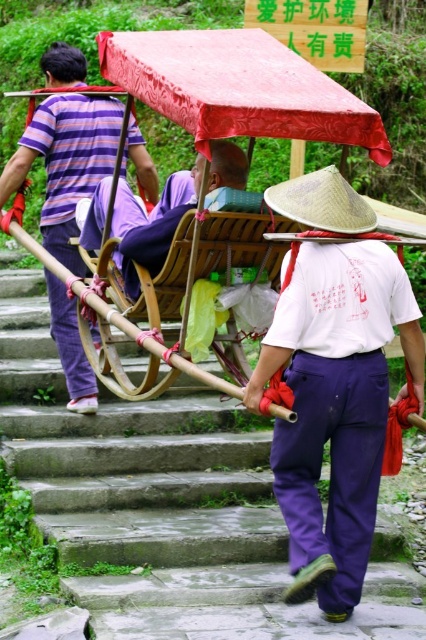
Is purple cotton pants at center shorter than natural straw hat at center?

In fact, purple cotton pants at center may be taller than natural straw hat at center.

Locate an element on the screen. purple cotton pants at center is located at coordinates (x=150, y=225).

Is wooden cart at center bigger than purple striped shirt at upper left?

Indeed, wooden cart at center has a larger size compared to purple striped shirt at upper left.

Is point (255, 84) behind point (147, 192)?

No, it is not.

At what (x,y) coordinates should I click in order to perform the action: click on wooden cart at center. Please return your answer as a coordinate pair (x, y). The height and width of the screenshot is (640, 426). Looking at the image, I should click on 236,88.

Where is `wooden cart at center`? wooden cart at center is located at coordinates (236, 88).

Can you confirm if wooden cart at center is shorter than natural straw hat at center?

No.

Is point (233, 124) positioned after point (294, 180)?

That is False.

Where is `wooden cart at center`? wooden cart at center is located at coordinates click(x=236, y=88).